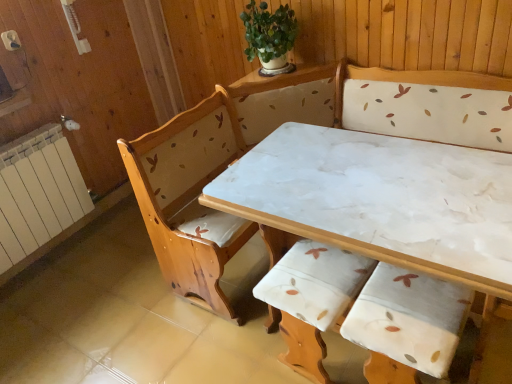
Question: From the image's perspective, is green leafy plant at upper center located above or below white painted radiator at left?

Choices:
 (A) below
 (B) above

Answer: (B)

Question: Considering the positions of green leafy plant at upper center and white painted radiator at left in the image, is green leafy plant at upper center taller or shorter than white painted radiator at left?

Choices:
 (A) short
 (B) tall

Answer: (A)

Question: Estimate the real-world distances between objects in this image. Which object is closer to the wooden armchair with floral upholstery at center?

Choices:
 (A) green leafy plant at upper center
 (B) white marble table at center
 (C) white painted radiator at left

Answer: (B)

Question: Which object is positioned closest to the green leafy plant at upper center?

Choices:
 (A) white painted radiator at left
 (B) white marble table at center
 (C) wooden armchair with floral upholstery at center

Answer: (B)